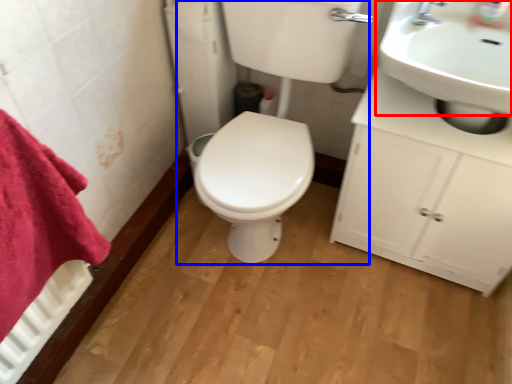
Question: Which object appears closest to the camera in this image, sink (highlighted by a red box) or porcelain (highlighted by a blue box)?

Choices:
 (A) sink
 (B) porcelain

Answer: (B)